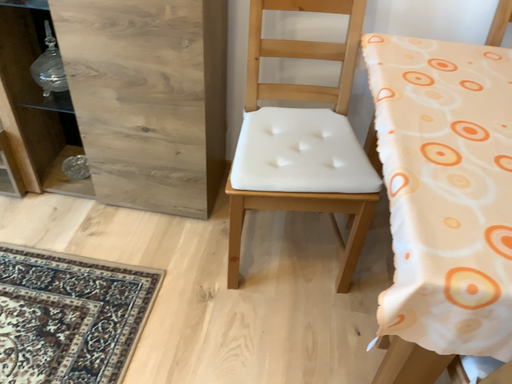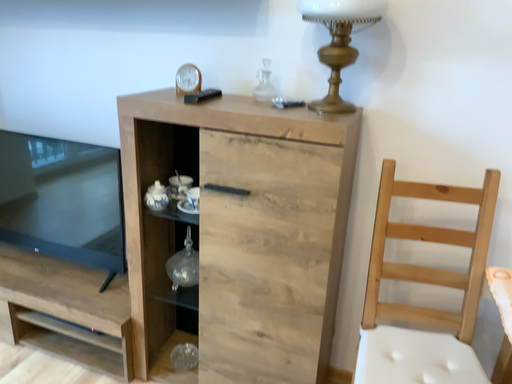
Question: Which way did the camera rotate in the video?

Choices:
 (A) rotated right
 (B) rotated left

Answer: (B)